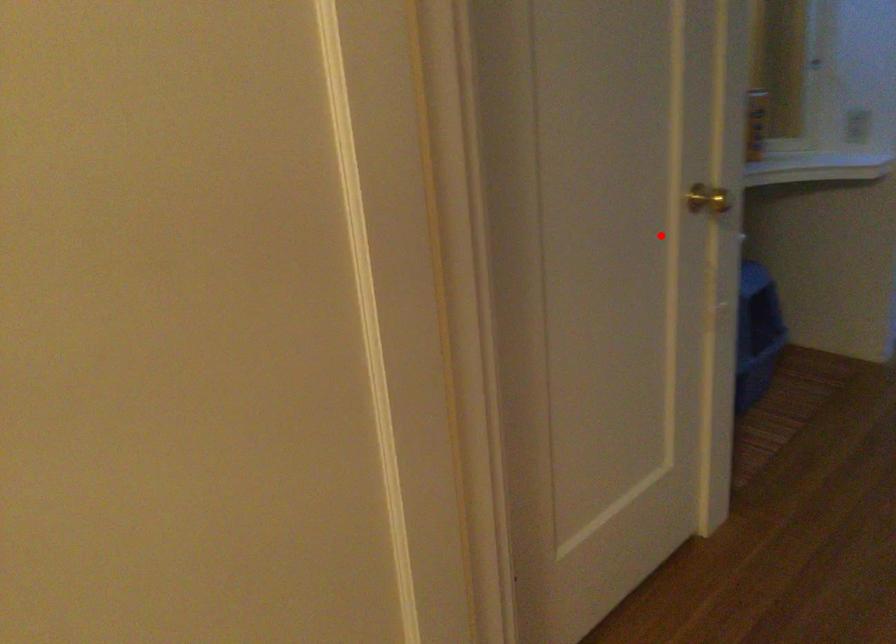
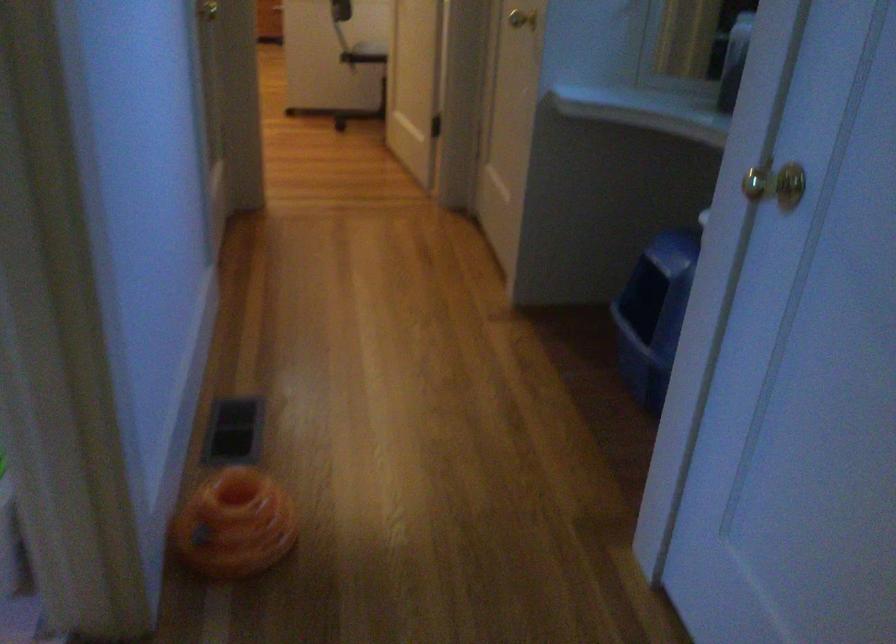
Question: I am providing you with two images of the same scene from different viewpoints. In image1, a red point is highlighted. Considering the same 3D point in image2, which of the following is correct?

Choices:
 (A) It is closer
 (B) It is farther

Answer: (B)